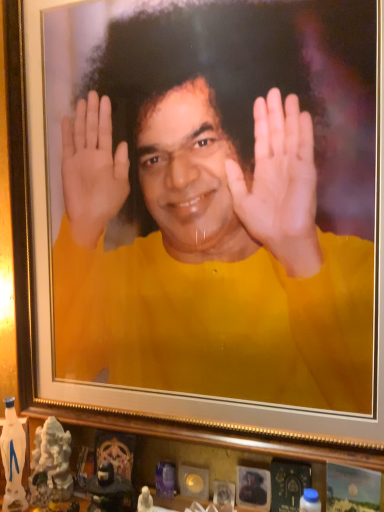
Question: Can you confirm if matte black statue at lower center, marked as the 1th toy in a right-to-left arrangement, is thinner than yellow matte shirt at center?

Choices:
 (A) yes
 (B) no

Answer: (B)

Question: From a real-world perspective, is matte black statue at lower center, marked as the 1th toy in a right-to-left arrangement, positioned under yellow matte shirt at center based on gravity?

Choices:
 (A) no
 (B) yes

Answer: (B)

Question: Is matte black statue at lower center, marked as the 1th toy in a right-to-left arrangement, wider than yellow matte shirt at center?

Choices:
 (A) yes
 (B) no

Answer: (A)

Question: Is matte black statue at lower center, marked as the 2th toy in a left-to-right arrangement, to the right of yellow matte shirt at center from the viewer's perspective?

Choices:
 (A) yes
 (B) no

Answer: (B)

Question: Is matte black statue at lower center, marked as the 1th toy in a right-to-left arrangement, bigger than yellow matte shirt at center?

Choices:
 (A) yes
 (B) no

Answer: (B)

Question: Is matte black statue at lower center, marked as the 1th toy in a right-to-left arrangement, smaller than yellow matte shirt at center?

Choices:
 (A) no
 (B) yes

Answer: (B)

Question: Is matte black statue at lower center, marked as the 1th toy in a right-to-left arrangement, turned away from white glossy statue at lower left, which ranks as the 1th toy in left-to-right order?

Choices:
 (A) yes
 (B) no

Answer: (B)

Question: Is matte black statue at lower center, marked as the 1th toy in a right-to-left arrangement, shorter than white glossy statue at lower left, which ranks as the 1th toy in left-to-right order?

Choices:
 (A) yes
 (B) no

Answer: (A)

Question: Would you say white glossy statue at lower left, acting as the 2th toy starting from the right, is part of matte black statue at lower center, marked as the 1th toy in a right-to-left arrangement,'s contents?

Choices:
 (A) no
 (B) yes

Answer: (A)

Question: Can you confirm if matte black statue at lower center, marked as the 2th toy in a left-to-right arrangement, is bigger than white glossy statue at lower left, acting as the 2th toy starting from the right?

Choices:
 (A) yes
 (B) no

Answer: (B)

Question: From a real-world perspective, is matte black statue at lower center, marked as the 2th toy in a left-to-right arrangement, physically above white glossy statue at lower left, which ranks as the 1th toy in left-to-right order?

Choices:
 (A) yes
 (B) no

Answer: (B)

Question: Is matte black statue at lower center, marked as the 2th toy in a left-to-right arrangement, placed right next to white glossy statue at lower left, which ranks as the 1th toy in left-to-right order?

Choices:
 (A) yes
 (B) no

Answer: (B)

Question: Is white glossy statue at lower left, which ranks as the 1th toy in left-to-right order, wider than matte black statue at lower center, marked as the 2th toy in a left-to-right arrangement?

Choices:
 (A) no
 (B) yes

Answer: (B)